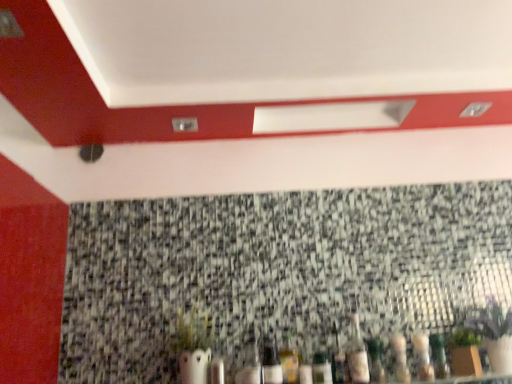
Image resolution: width=512 pixels, height=384 pixels. What are the coordinates of `translucent glass bottle at lower right, which is the 6th bottle in left-to-right order` in the screenshot? It's located at (400, 358).

How much space does translucent glass bottle at lower right, the 2th bottle when ordered from right to left, occupy horizontally?

The width of translucent glass bottle at lower right, the 2th bottle when ordered from right to left, is 3.89 inches.

What is the approximate width of clear glass bottle at center, the fourth bottle in the left-to-right sequence?

1.70 inches.

The height and width of the screenshot is (384, 512). Identify the location of clear glass bottle at center, the fourth bottle in the left-to-right sequence. (337, 358).

This screenshot has width=512, height=384. What do you see at coordinates (357, 354) in the screenshot?
I see `translucent glass bottle at center, which is counted as the third bottle, starting from the right` at bounding box center [357, 354].

Find the location of a particular element. The image size is (512, 384). translucent glass bottle at center, the 3th bottle from the left is located at coordinates (321, 367).

This screenshot has height=384, width=512. Find the location of `white matte vase at lower center`. white matte vase at lower center is located at coordinates (192, 330).

This screenshot has height=384, width=512. What do you see at coordinates (288, 358) in the screenshot? I see `translucent glass bottle at lower center, the second bottle when ordered from left to right` at bounding box center [288, 358].

Where is `clear glass bottle at center, acting as the seventh bottle starting from the right`? The height and width of the screenshot is (384, 512). clear glass bottle at center, acting as the seventh bottle starting from the right is located at coordinates pos(271,362).

Does point (177, 346) lie behind point (278, 354)?

That is False.

Is white matte vase at lower center to the left or to the right of translucent glass bottle at lower center, the second bottle when ordered from left to right, in the image?

white matte vase at lower center is positioned on translucent glass bottle at lower center, the second bottle when ordered from left to right,'s left side.

Is white matte vase at lower center far away from translucent glass bottle at lower center, arranged as the 6th bottle when viewed from the right?

Actually, white matte vase at lower center and translucent glass bottle at lower center, arranged as the 6th bottle when viewed from the right, are a little close together.

From the image's perspective, between white matte vase at lower center and translucent glass bottle at lower center, the second bottle when ordered from left to right, which one is located above?

white matte vase at lower center.

From a real-world perspective, is granite mosaic at center below clear glass bottle at center, which ranks as the fourth bottle in right-to-left order?

No, from a real-world perspective, granite mosaic at center is not under clear glass bottle at center, which ranks as the fourth bottle in right-to-left order.

Is granite mosaic at center facing towards clear glass bottle at center, the fourth bottle in the left-to-right sequence?

Yes, granite mosaic at center faces towards clear glass bottle at center, the fourth bottle in the left-to-right sequence.

Which is behind, granite mosaic at center or clear glass bottle at center, the fourth bottle in the left-to-right sequence?

granite mosaic at center is more distant.

Is granite mosaic at center shorter than clear glass bottle at center, the fourth bottle in the left-to-right sequence?

No.

Could you tell me if translucent glass bottle at center, the 5th bottle in the left-to-right sequence, is turned towards translucent glass bottle at lower right, which is the 7th bottle in left-to-right order?

No, translucent glass bottle at center, the 5th bottle in the left-to-right sequence, is not aimed at translucent glass bottle at lower right, which is the 7th bottle in left-to-right order.

Considering the sizes of objects translucent glass bottle at center, the 5th bottle in the left-to-right sequence, and translucent glass bottle at lower right, marked as the first bottle in a right-to-left arrangement, in the image provided, who is wider, translucent glass bottle at center, the 5th bottle in the left-to-right sequence, or translucent glass bottle at lower right, marked as the first bottle in a right-to-left arrangement,?

With larger width is translucent glass bottle at lower right, marked as the first bottle in a right-to-left arrangement.

Which of these two, translucent glass bottle at lower center, arranged as the 6th bottle when viewed from the right, or translucent glass bottle at lower right, which is the 7th bottle in left-to-right order, is smaller?

With smaller size is translucent glass bottle at lower center, arranged as the 6th bottle when viewed from the right.

Considering the sizes of translucent glass bottle at lower center, arranged as the 6th bottle when viewed from the right, and translucent glass bottle at lower right, which is the 7th bottle in left-to-right order, in the image, is translucent glass bottle at lower center, arranged as the 6th bottle when viewed from the right, taller or shorter than translucent glass bottle at lower right, which is the 7th bottle in left-to-right order,?

Considering their sizes, translucent glass bottle at lower center, arranged as the 6th bottle when viewed from the right, has less height than translucent glass bottle at lower right, which is the 7th bottle in left-to-right order.

Which is closer, (292, 366) or (413, 338)?

The point (292, 366) is in front.

From a real-world perspective, does translucent glass bottle at lower center, arranged as the 6th bottle when viewed from the right, sit lower than translucent glass bottle at lower right, which is the 7th bottle in left-to-right order?

Yes, from a real-world perspective, translucent glass bottle at lower center, arranged as the 6th bottle when viewed from the right, is below translucent glass bottle at lower right, which is the 7th bottle in left-to-right order.

Could you tell me if translucent glass bottle at lower right, marked as the first bottle in a right-to-left arrangement, is turned towards translucent glass bottle at center, which is counted as the third bottle, starting from the right?

No, translucent glass bottle at lower right, marked as the first bottle in a right-to-left arrangement, is not aimed at translucent glass bottle at center, which is counted as the third bottle, starting from the right.

Considering their positions, is translucent glass bottle at lower right, which is the 7th bottle in left-to-right order, located in front of or behind translucent glass bottle at center, the 5th bottle in the left-to-right sequence?

translucent glass bottle at lower right, which is the 7th bottle in left-to-right order, is in front of translucent glass bottle at center, the 5th bottle in the left-to-right sequence.

Which is less distant, (418,368) or (349,348)?

Point (418,368) is positioned closer to the camera compared to point (349,348).

How many degrees apart are the facing directions of translucent glass bottle at lower right, marked as the first bottle in a right-to-left arrangement, and translucent glass bottle at center, the 5th bottle in the left-to-right sequence?

The angular difference between translucent glass bottle at lower right, marked as the first bottle in a right-to-left arrangement, and translucent glass bottle at center, the 5th bottle in the left-to-right sequence, is 0.00356 degrees.

Is translucent glass bottle at lower right, marked as the first bottle in a right-to-left arrangement, completely or partially inside white matte vase at lower center?

No, translucent glass bottle at lower right, marked as the first bottle in a right-to-left arrangement, is not a part of white matte vase at lower center.

From the image's perspective, is white matte vase at lower center located beneath translucent glass bottle at lower right, which is the 7th bottle in left-to-right order?

No, from the image's perspective, white matte vase at lower center is not beneath translucent glass bottle at lower right, which is the 7th bottle in left-to-right order.

Is white matte vase at lower center facing away from translucent glass bottle at lower right, which is the 7th bottle in left-to-right order?

No.

From the picture: Is white matte vase at lower center placed right next to translucent glass bottle at lower right, which is the 7th bottle in left-to-right order?

No, white matte vase at lower center is not making contact with translucent glass bottle at lower right, which is the 7th bottle in left-to-right order.

What's the angular difference between white matte vase at lower center and clear glass bottle at center, acting as the seventh bottle starting from the right,'s facing directions?

0.00382 degrees.

Is white matte vase at lower center looking in the opposite direction of clear glass bottle at center, acting as the seventh bottle starting from the right?

No, clear glass bottle at center, acting as the seventh bottle starting from the right, is not at the back of white matte vase at lower center.

Which is correct: white matte vase at lower center is inside clear glass bottle at center, which appears as the 1th bottle when viewed from the left, or outside of it?

white matte vase at lower center exists outside the volume of clear glass bottle at center, which appears as the 1th bottle when viewed from the left.

Between white matte vase at lower center and clear glass bottle at center, which appears as the 1th bottle when viewed from the left, which one appears on the left side from the viewer's perspective?

From the viewer's perspective, white matte vase at lower center appears more on the left side.

There is a white matte vase at lower center. At what (x,y) coordinates should I click in order to perform the action: click on the 6th bottle below it (from the image's perspective). Please return your answer as a coordinate pair (x, y). Looking at the image, I should click on (288, 358).

The height and width of the screenshot is (384, 512). What are the coordinates of `the 2nd bottle to the right when counting from the granite mosaic at center` in the screenshot? It's located at (337, 358).

Looking at the image, which one is located closer to translucent glass bottle at lower right, which is the 6th bottle in left-to-right order, clear glass bottle at center, which appears as the 1th bottle when viewed from the left, or translucent glass bottle at lower center, arranged as the 6th bottle when viewed from the right?

The object closer to translucent glass bottle at lower right, which is the 6th bottle in left-to-right order, is translucent glass bottle at lower center, arranged as the 6th bottle when viewed from the right.

Which object lies further to the anchor point translucent glass bottle at center, the 3th bottle from the left, clear glass bottle at center, the fourth bottle in the left-to-right sequence, or granite mosaic at center?

granite mosaic at center.

Which object lies nearer to the anchor point translucent glass bottle at lower right, the 2th bottle when ordered from right to left, clear glass bottle at center, which ranks as the fourth bottle in right-to-left order, or translucent glass bottle at lower center, arranged as the 6th bottle when viewed from the right?

clear glass bottle at center, which ranks as the fourth bottle in right-to-left order, is positioned closer to the anchor translucent glass bottle at lower right, the 2th bottle when ordered from right to left.

From the image, which object appears to be farther from translucent glass bottle at lower center, the second bottle when ordered from left to right, clear glass bottle at center, which appears as the 1th bottle when viewed from the left, or clear glass bottle at center, which ranks as the fourth bottle in right-to-left order?

clear glass bottle at center, which ranks as the fourth bottle in right-to-left order, lies further to translucent glass bottle at lower center, the second bottle when ordered from left to right, than the other object.

Which object lies further to the anchor point translucent glass bottle at lower right, which is the 7th bottle in left-to-right order, granite mosaic at center or clear glass bottle at center, which appears as the 1th bottle when viewed from the left?

granite mosaic at center.

From the image, which object appears to be farther from translucent glass bottle at center, the 3th bottle from the left, translucent glass bottle at lower center, arranged as the 6th bottle when viewed from the right, or translucent glass bottle at lower right, marked as the first bottle in a right-to-left arrangement?

translucent glass bottle at lower right, marked as the first bottle in a right-to-left arrangement.

When comparing their distances from translucent glass bottle at lower right, which is the 6th bottle in left-to-right order, does translucent glass bottle at lower center, the second bottle when ordered from left to right, or translucent glass bottle at center, the 5th bottle in the left-to-right sequence, seem further?

translucent glass bottle at lower center, the second bottle when ordered from left to right, is positioned further to the anchor translucent glass bottle at lower right, which is the 6th bottle in left-to-right order.

From the image, which object appears to be nearer to clear glass bottle at center, acting as the seventh bottle starting from the right, translucent glass bottle at lower right, the 2th bottle when ordered from right to left, or translucent glass bottle at center, which ranks as the 5th bottle in right-to-left order?

Based on the image, translucent glass bottle at center, which ranks as the 5th bottle in right-to-left order, appears to be nearer to clear glass bottle at center, acting as the seventh bottle starting from the right.

Locate an element on the screen. bottle between clear glass bottle at center, which ranks as the fourth bottle in right-to-left order, and translucent glass bottle at lower right, which is the 6th bottle in left-to-right order, from left to right is located at coordinates [357, 354].

You are a GUI agent. You are given a task and a screenshot of the screen. Output one action in this format:
    pyautogui.click(x=<x>, y=<y>)
    Task: Click on the granite located between white matte vase at lower center and translucent glass bottle at center, the 5th bottle in the left-to-right sequence, in the left-right direction
    
    Given the screenshot: What is the action you would take?
    pyautogui.click(x=276, y=270)

The image size is (512, 384). Identify the location of bottle between translucent glass bottle at lower center, the second bottle when ordered from left to right, and clear glass bottle at center, which ranks as the fourth bottle in right-to-left order, in the horizontal direction. (321, 367).

I want to click on granite between white matte vase at lower center and translucent glass bottle at lower right, the 2th bottle when ordered from right to left, from left to right, so click(x=276, y=270).